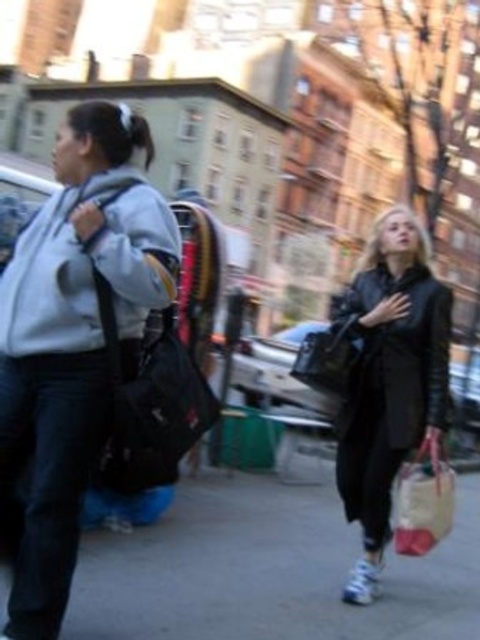
Question: From the image, what is the correct spatial relationship of matte gray hoodie at left in relation to black matte sweatshirt at right?

Choices:
 (A) right
 (B) left

Answer: (B)

Question: Observing the image, what is the correct spatial positioning of gray concrete pavement at lower center in reference to matte gray sweatshirt at left?

Choices:
 (A) above
 (B) below

Answer: (B)

Question: In this image, where is gray concrete pavement at lower center located relative to dark brown hair at upper left?

Choices:
 (A) left
 (B) right

Answer: (B)

Question: Which point is farther from the camera taking this photo?

Choices:
 (A) (346, 348)
 (B) (105, 588)
 (C) (376, 280)
 (D) (66, 264)

Answer: (C)

Question: Considering the real-world distances, which object is farthest from the black matte sweatshirt at right?

Choices:
 (A) gray concrete pavement at lower center
 (B) shiny black handbag at center
 (C) black leather coat at right
 (D) matte gray sweatshirt at left

Answer: (D)

Question: Which of the following is the farthest from the observer?

Choices:
 (A) (425, 291)
 (B) (47, 349)

Answer: (A)